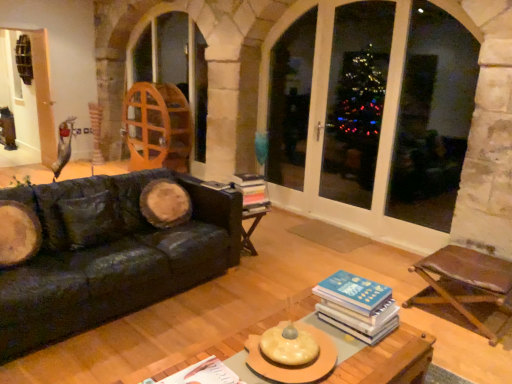
I want to click on blank space situated above white paper book at center, the 1th book when ordered from bottom to top (from a real-world perspective), so coord(202,375).